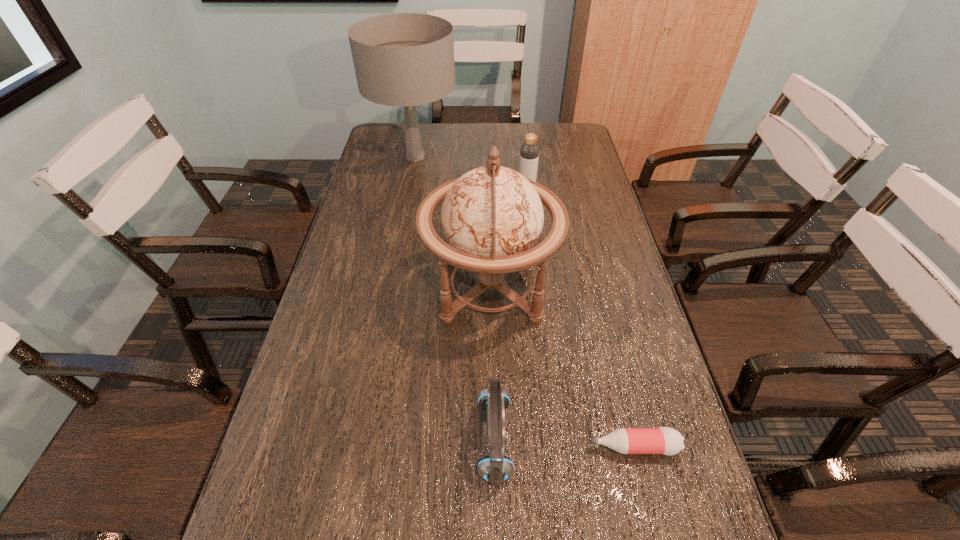
This screenshot has height=540, width=960. I want to click on blank area in the image that satisfies the following two spatial constraints: 1. on the front-facing side of the lampshade; 2. on the right side of the second farthest object, so click(409, 193).